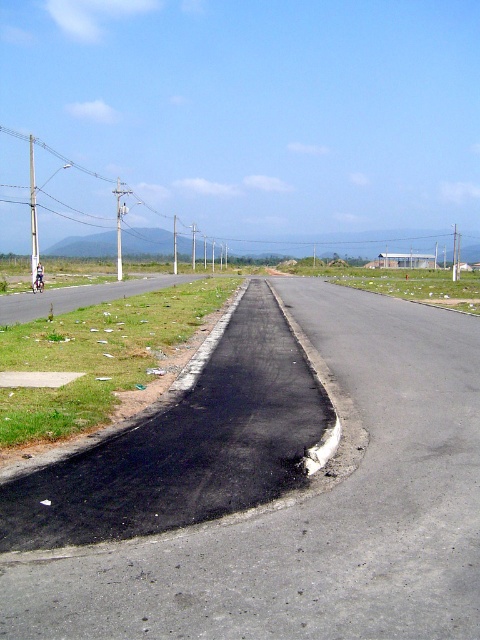
Question: Is blue fabric motorcyclist at center thinner than metallic silver motorcycle at center?

Choices:
 (A) no
 (B) yes

Answer: (B)

Question: Which object appears farthest from the camera in this image?

Choices:
 (A) metallic silver motorcycle at center
 (B) blue fabric motorcyclist at center

Answer: (B)

Question: Is blue fabric motorcyclist at center closer to camera compared to metallic silver motorcycle at center?

Choices:
 (A) no
 (B) yes

Answer: (A)

Question: Does blue fabric motorcyclist at center appear on the right side of metallic silver motorcycle at center?

Choices:
 (A) no
 (B) yes

Answer: (A)